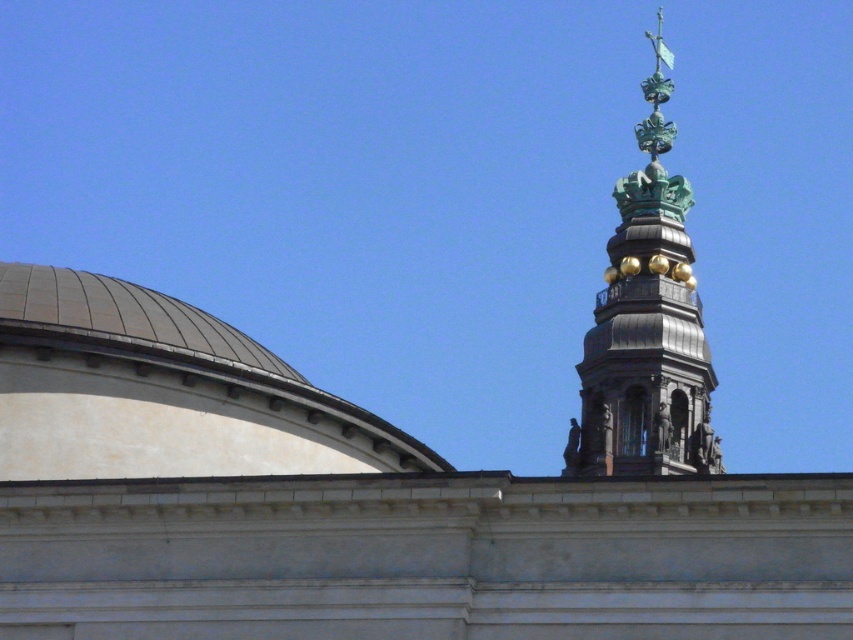
What do you see at coordinates (161, 392) in the screenshot? I see `smooth white dome at upper left` at bounding box center [161, 392].

Which is below, smooth white dome at upper left or green patina tower at upper right?

smooth white dome at upper left is below.

Between point (109, 445) and point (657, 433), which one is positioned in front?

Positioned in front is point (109, 445).

Image resolution: width=853 pixels, height=640 pixels. I want to click on smooth white dome at upper left, so click(161, 392).